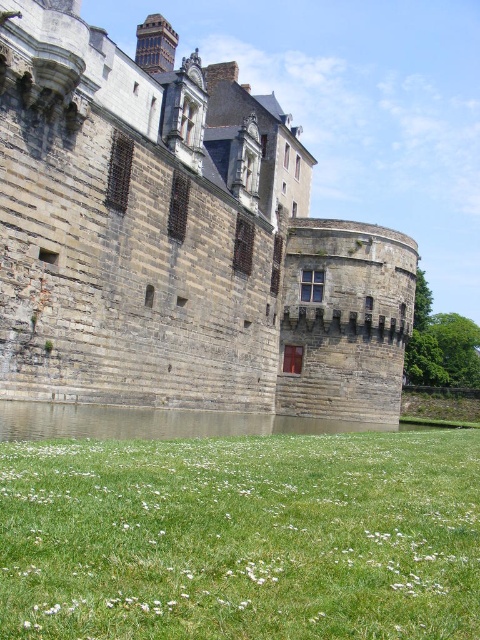
In the scene shown: You are a medieval architect planning to build a new watchtower 120 feet away from the gray stone castle at center. Based on the current layout, will the new watchtower be within the castle grounds?

The distance between the new watchtower and the gray stone castle at center is 119.67 feet, which is less than 120 feet. Therefore, the new watchtower will be within the castle grounds.